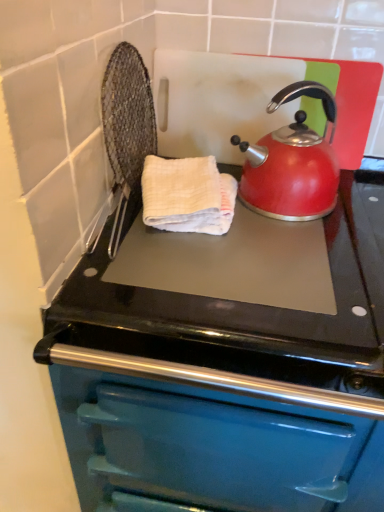
The height and width of the screenshot is (512, 384). Find the location of `vacant space to the right of white textured hand towel at center`. vacant space to the right of white textured hand towel at center is located at coordinates (281, 247).